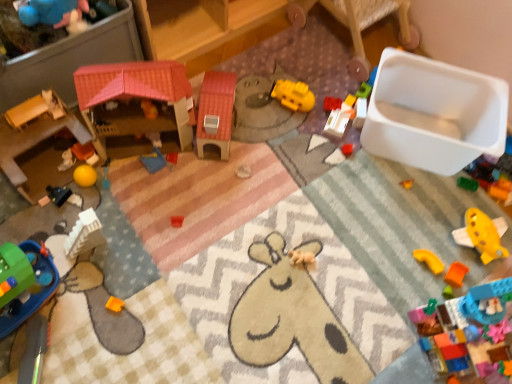
You are a GUI agent. You are given a task and a screenshot of the screen. Output one action in this format:
    pyautogui.click(x=<x>, y=<y>)
    Task: Click on the blank space to the left of blue plastic tray at center, acting as the 6th toy starting from the left
    
    Given the screenshot: What is the action you would take?
    pyautogui.click(x=115, y=170)